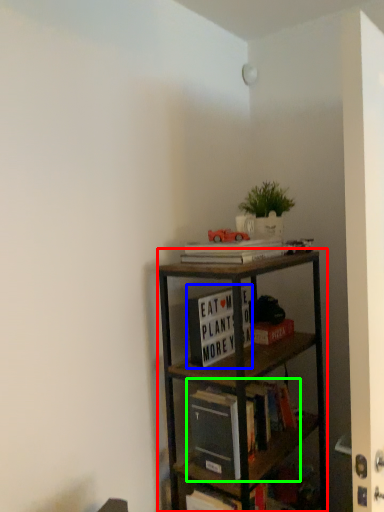
Question: Which object is positioned closest to shelf (highlighted by a red box)? Select from book (highlighted by a blue box) and book (highlighted by a green box).

Choices:
 (A) book
 (B) book

Answer: (B)